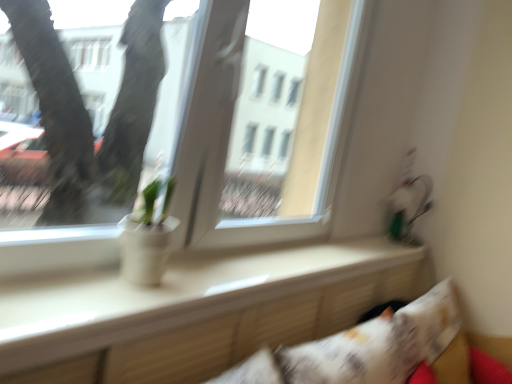
Question: Does white printed pillow at lower right have a greater width compared to white glossy window sill at center?

Choices:
 (A) no
 (B) yes

Answer: (B)

Question: From the image's perspective, is white printed pillow at lower right located above white glossy window sill at center?

Choices:
 (A) no
 (B) yes

Answer: (A)

Question: Considering the relative sizes of white printed pillow at lower right and white glossy window sill at center in the image provided, is white printed pillow at lower right thinner than white glossy window sill at center?

Choices:
 (A) no
 (B) yes

Answer: (A)

Question: Is white printed pillow at lower right at the right side of white glossy window sill at center?

Choices:
 (A) no
 (B) yes

Answer: (B)

Question: From a real-world perspective, is white printed pillow at lower right under white glossy window sill at center?

Choices:
 (A) yes
 (B) no

Answer: (A)

Question: Does point (172, 188) appear closer or farther from the camera than point (185, 365)?

Choices:
 (A) farther
 (B) closer

Answer: (A)

Question: From the image's perspective, is white matte pot at center positioned above or below white glossy window sill at center?

Choices:
 (A) above
 (B) below

Answer: (A)

Question: Based on their sizes in the image, would you say white matte pot at center is bigger or smaller than white glossy window sill at center?

Choices:
 (A) big
 (B) small

Answer: (B)

Question: In terms of width, does white matte pot at center look wider or thinner when compared to white glossy window sill at center?

Choices:
 (A) wide
 (B) thin

Answer: (B)

Question: Looking at the image, does transparent glass window at center seem bigger or smaller compared to white printed pillow at lower right?

Choices:
 (A) small
 (B) big

Answer: (B)

Question: Is transparent glass window at center wider or thinner than white printed pillow at lower right?

Choices:
 (A) wide
 (B) thin

Answer: (B)

Question: Is point (250, 94) closer or farther from the camera than point (332, 357)?

Choices:
 (A) closer
 (B) farther

Answer: (B)

Question: Is transparent glass window at center taller or shorter than white printed pillow at lower right?

Choices:
 (A) short
 (B) tall

Answer: (B)

Question: Considering their positions, is white glossy window sill at center located in front of or behind white matte pot at center?

Choices:
 (A) front
 (B) behind

Answer: (A)

Question: Is point (134, 365) closer or farther from the camera than point (147, 230)?

Choices:
 (A) closer
 (B) farther

Answer: (A)